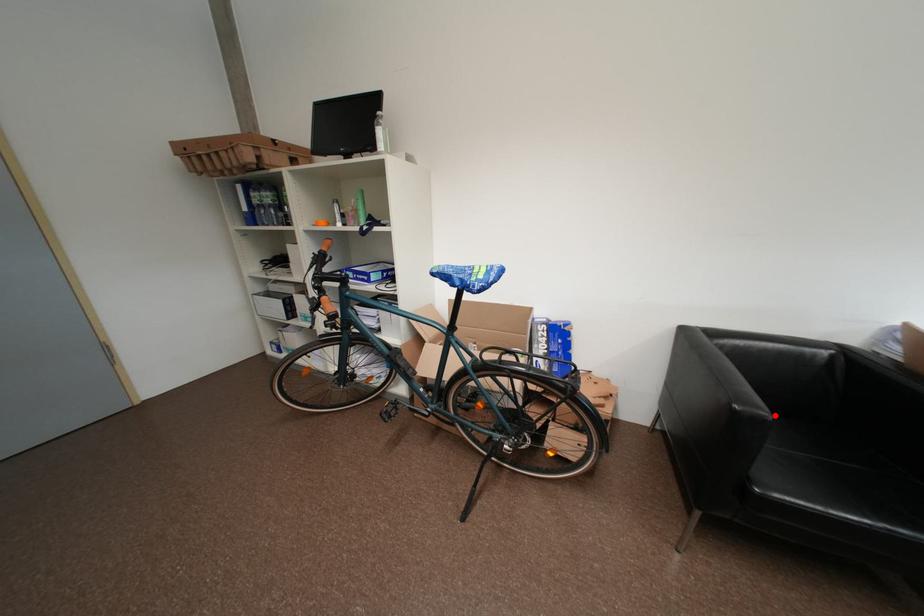
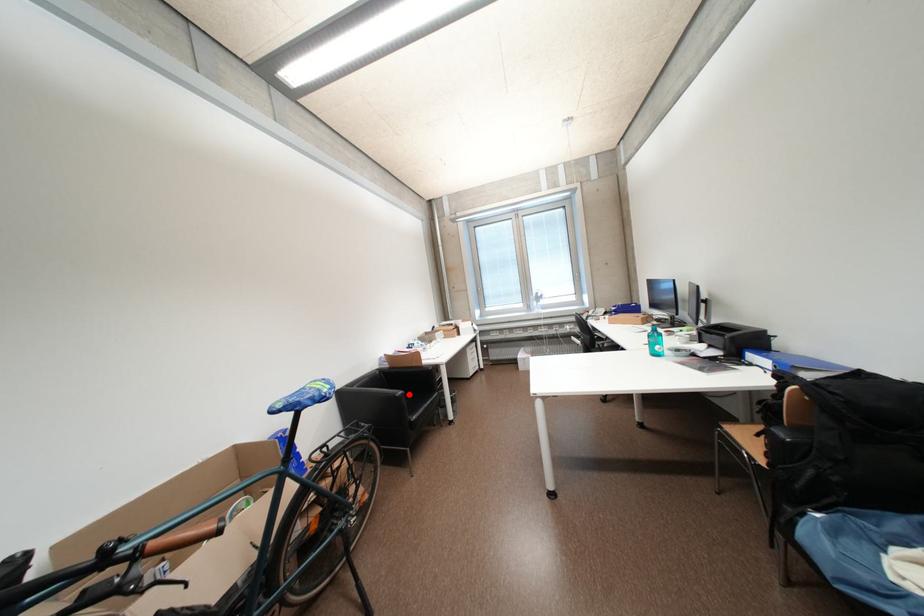
I am providing you with two images of the same scene from different viewpoints. A red point is marked on the first image and another point is marked on the second image. Is the marked point in image1 the same physical position as the marked point in image2?

Yes